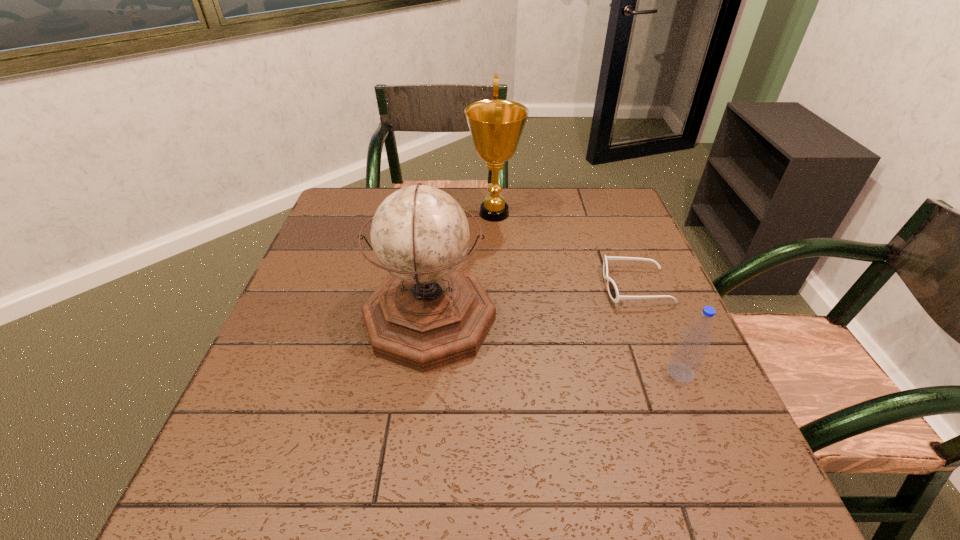
In order to click on free spot between the second shortest object and the shortest object in this screenshot , I will do `click(659, 329)`.

Locate an element on the screen. This screenshot has height=540, width=960. object that ranks as the second closest to the globe is located at coordinates (613, 292).

Point out which object is positioned as the nearest to the globe. Please provide its 2D coordinates. Your answer should be formatted as a tuple, i.e. [(x, y)], where the tuple contains the x and y coordinates of a point satisfying the conditions above.

[(496, 126)]

Where is `vacant space that satisfies the following two spatial constraints: 1. with the lenses of the third tallest object facing outward; 2. on the left side of the shortest object`? This screenshot has height=540, width=960. vacant space that satisfies the following two spatial constraints: 1. with the lenses of the third tallest object facing outward; 2. on the left side of the shortest object is located at coordinates (670, 373).

At what (x,y) coordinates should I click in order to perform the action: click on blank area in the image that satisfies the following two spatial constraints: 1. on the surface of the globe; 2. on the left side of the third tallest object. Please return your answer as a coordinate pair (x, y). Looking at the image, I should click on (423, 373).

This screenshot has width=960, height=540. In order to click on vacant region that satisfies the following two spatial constraints: 1. on the surface of the globe; 2. on the right side of the second shortest object in this screenshot , I will do `click(423, 373)`.

In order to click on free location that satisfies the following two spatial constraints: 1. on the surface of the second shortest object; 2. on the right side of the globe in this screenshot , I will do `click(423, 373)`.

In order to click on blank space that satisfies the following two spatial constraints: 1. on the front view with handles of the award; 2. on the back side of the third tallest object in this screenshot , I will do `click(501, 373)`.

Find the location of `free spot that satisfies the following two spatial constraints: 1. with the lenses of the shortest object facing outward; 2. on the back side of the second shortest object`. free spot that satisfies the following two spatial constraints: 1. with the lenses of the shortest object facing outward; 2. on the back side of the second shortest object is located at coordinates (670, 373).

The height and width of the screenshot is (540, 960). I want to click on vacant region that satisfies the following two spatial constraints: 1. on the back side of the second shortest object; 2. with the lenses of the shortest object facing outward, so click(645, 286).